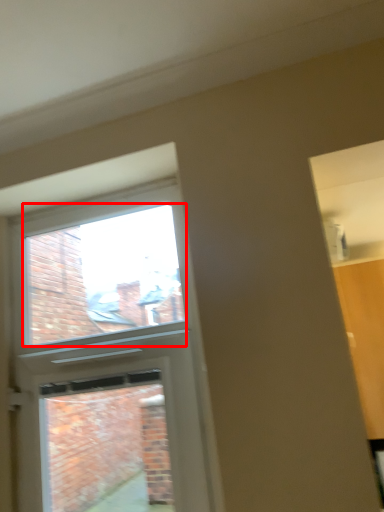
Question: From the image, what is the correct spatial relationship of window screen (annotated by the red box) in relation to screen door?

Choices:
 (A) right
 (B) left

Answer: (B)